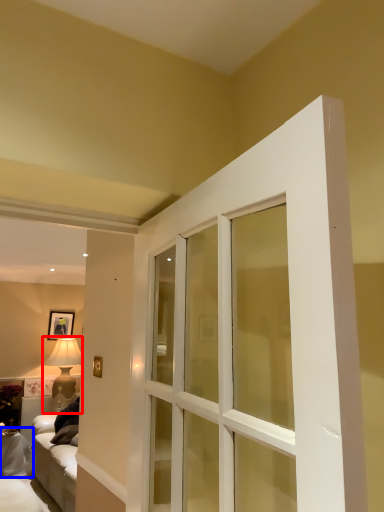
Question: Which object appears farthest to the camera in this image, lamp (highlighted by a red box) or furniture (highlighted by a blue box)?

Choices:
 (A) lamp
 (B) furniture

Answer: (A)